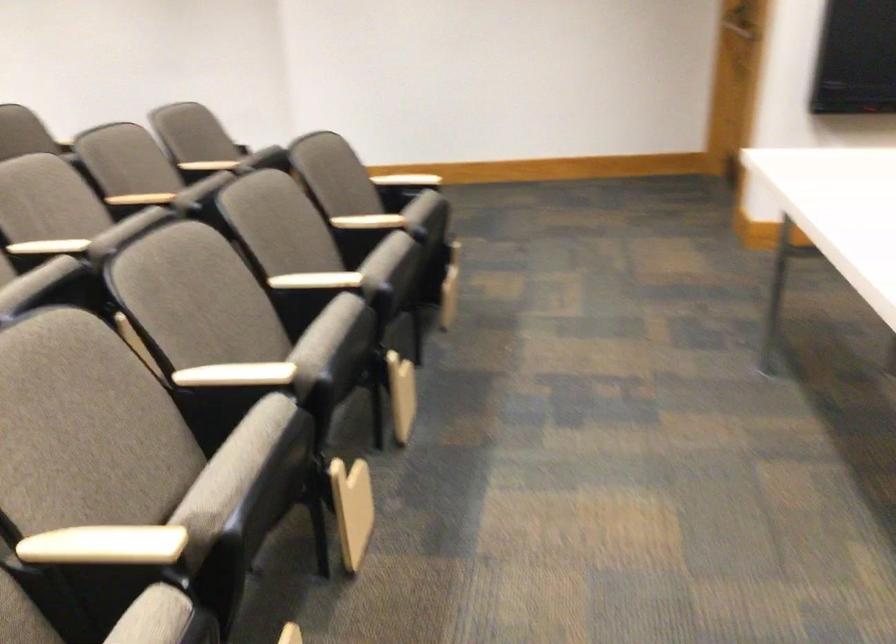
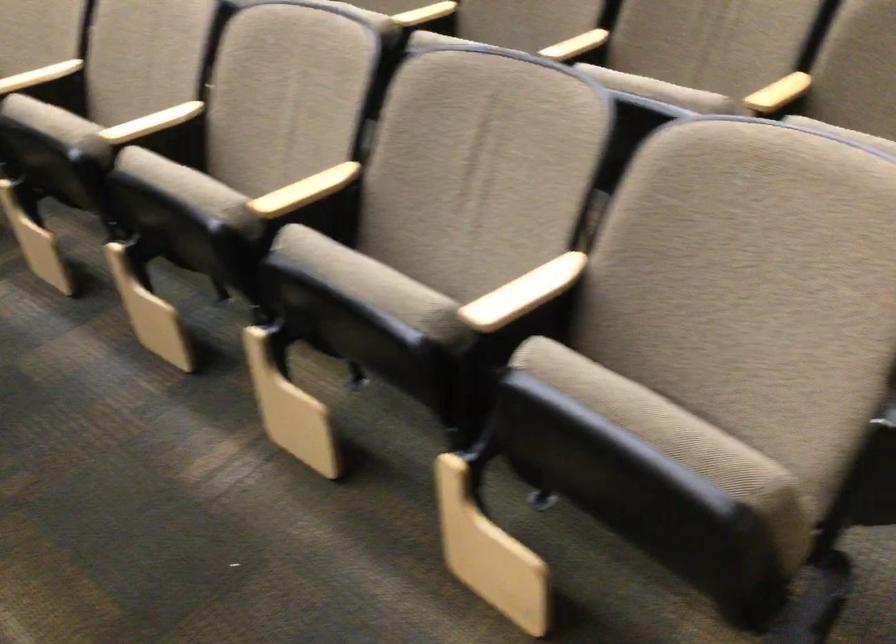
In the second image, find the point that corresponds to point 73,210 in the first image.

(151, 122)